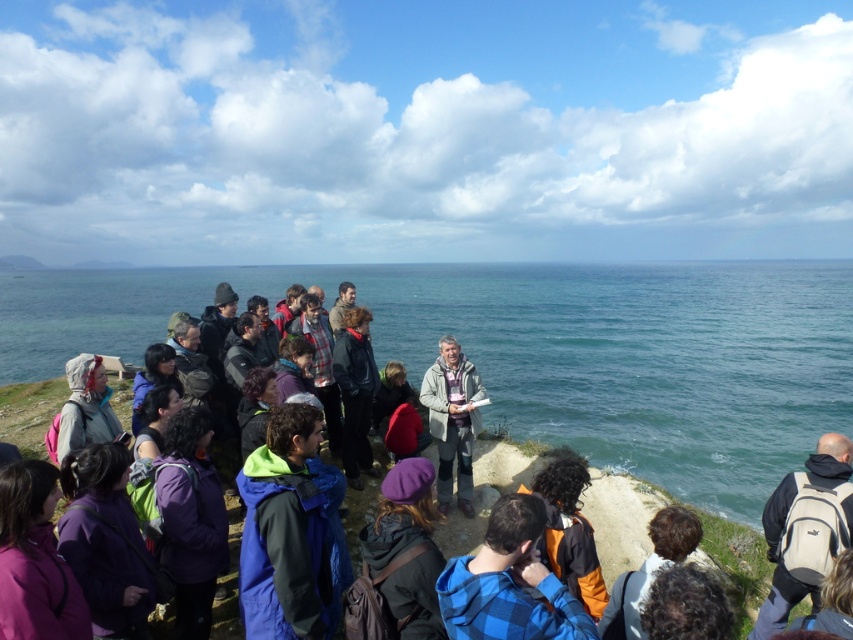
You are a photographer positioned at the edge of the cliff, aiming to capture a photo of the purple woolen hat at center and the orange fabric jacket at lower center in the same frame. Given that your camera has a maximum focus range of 1 meter, will both objects be in focus simultaneously?

The distance between the purple woolen hat at center and the orange fabric jacket at lower center is 95.52 centimeters, which is less than 1 meter. Therefore, both objects will be in focus simultaneously.

You are part of the group on the cliff and need to retrieve your belongings before moving to the next activity. Which item would you reach first if you move directly towards the beige fabric backpack at lower right and brown woolen hat at lower right?

The beige fabric backpack at lower right is closer to you than the brown woolen hat at lower right, so you would reach the beige fabric backpack at lower right first.

What is the object located at the coordinates point (405, 548) in the scene?

The point (405, 548) is on the purple woolen hat at center.